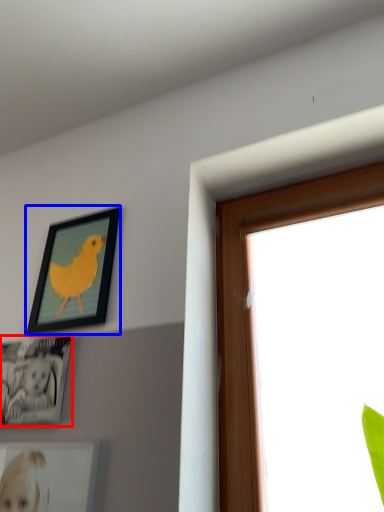
Question: Which object appears closest to the camera in this image, picture frame (highlighted by a red box) or picture frame (highlighted by a blue box)?

Choices:
 (A) picture frame
 (B) picture frame

Answer: (A)